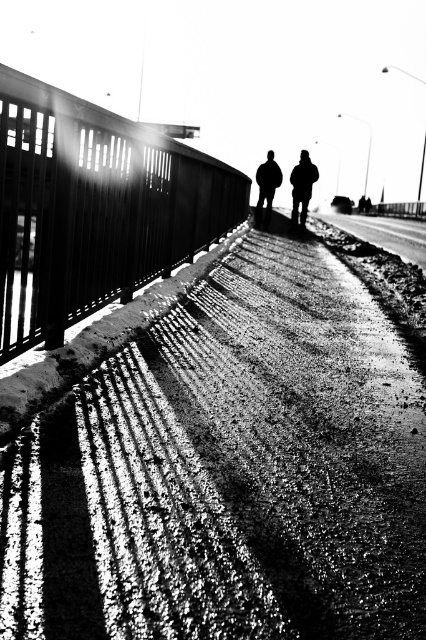
Question: Which of the following is the farthest from the observer?

Choices:
 (A) (92, 289)
 (B) (267, 196)
 (C) (319, 481)
 (D) (307, 170)

Answer: (B)

Question: Is rough asphalt at center to the left of smooth metal rail at left from the viewer's perspective?

Choices:
 (A) yes
 (B) no

Answer: (B)

Question: Can you confirm if smooth metal rail at left is positioned above dark textured jacket at center?

Choices:
 (A) yes
 (B) no

Answer: (B)

Question: Which object is positioned farthest from the dark fabric jacket at center?

Choices:
 (A) dark textured jacket at center
 (B) smooth metal rail at left
 (C) rough asphalt at center

Answer: (C)

Question: Among these points, which one is nearest to the camera?

Choices:
 (A) (201, 230)
 (B) (296, 189)

Answer: (A)

Question: From the image, what is the correct spatial relationship of rough asphalt at center in relation to smooth metal rail at left?

Choices:
 (A) right
 (B) left

Answer: (A)